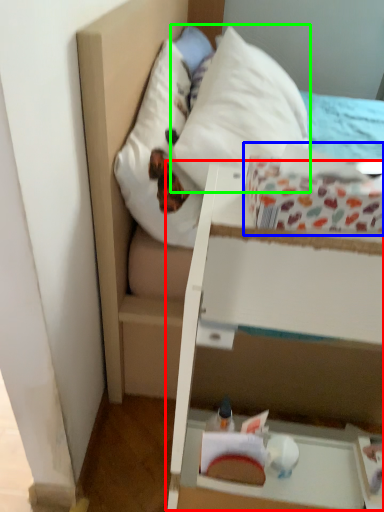
Question: Considering the real-world distances, which object is farthest from vanity (highlighted by a red box)? cardboard box (highlighted by a blue box) or pillow (highlighted by a green box)?

Choices:
 (A) cardboard box
 (B) pillow

Answer: (B)